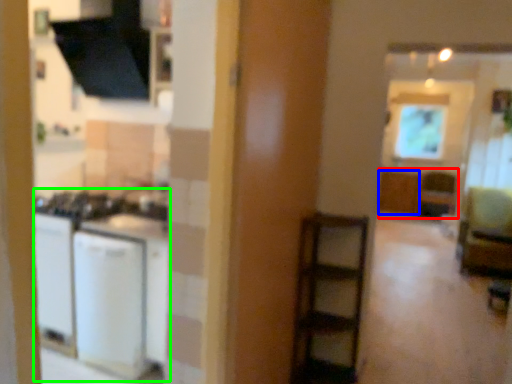
Question: Which object is the farthest from cabinetry (highlighted by a red box)? Choose among these: cabinetry (highlighted by a blue box) or appliance (highlighted by a green box).

Choices:
 (A) cabinetry
 (B) appliance

Answer: (B)